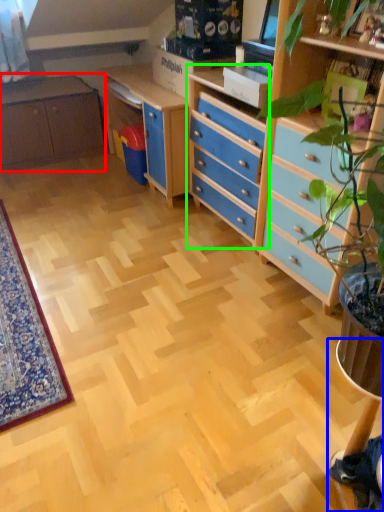
Question: Which is farther away from cabinetry (highlighted by a red box)? computer desk (highlighted by a blue box) or chest of drawers (highlighted by a green box)?

Choices:
 (A) computer desk
 (B) chest of drawers

Answer: (A)